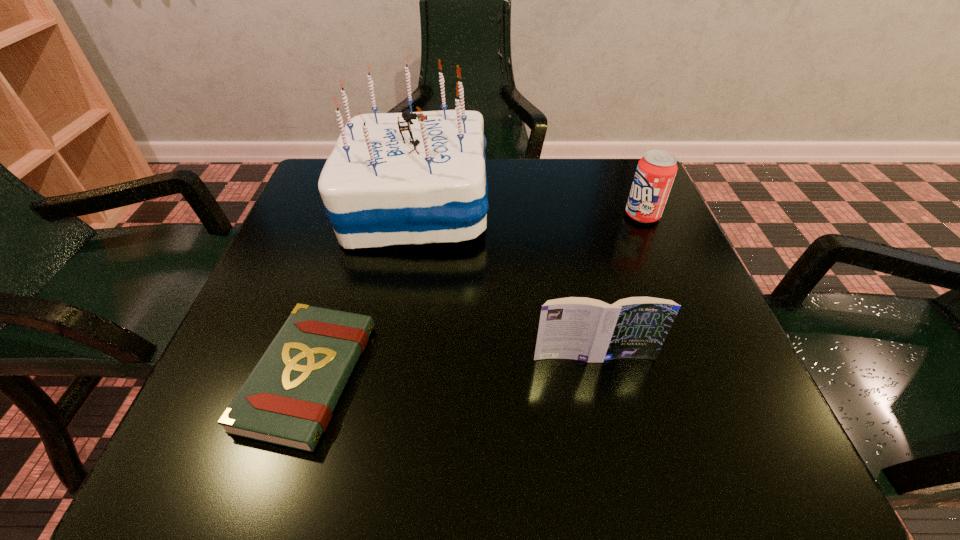
The width and height of the screenshot is (960, 540). I want to click on object that is at the near left corner, so click(x=288, y=399).

Where is `object that is at the far right corner`? object that is at the far right corner is located at coordinates (656, 170).

In the image, there is a desktop. Identify the location of vacant space at the far edge. (506, 191).

Identify the location of vacant space at the near edge of the desktop. (439, 448).

Find the location of a particular element. The height and width of the screenshot is (540, 960). free location at the left edge of the desktop is located at coordinates (316, 256).

Locate an element on the screen. vacant space at the right edge of the desktop is located at coordinates (623, 260).

Locate an element on the screen. This screenshot has width=960, height=540. vacant region at the far right corner is located at coordinates (583, 158).

At what (x,y) coordinates should I click in order to perform the action: click on free space at the near right corner. Please return your answer as a coordinate pair (x, y). This screenshot has width=960, height=540. Looking at the image, I should click on (664, 428).

Where is `vacant point located between the tallest object and the rightmost object`? The width and height of the screenshot is (960, 540). vacant point located between the tallest object and the rightmost object is located at coordinates (529, 210).

Where is `free point between the shortest object and the tallest object`? This screenshot has height=540, width=960. free point between the shortest object and the tallest object is located at coordinates (362, 290).